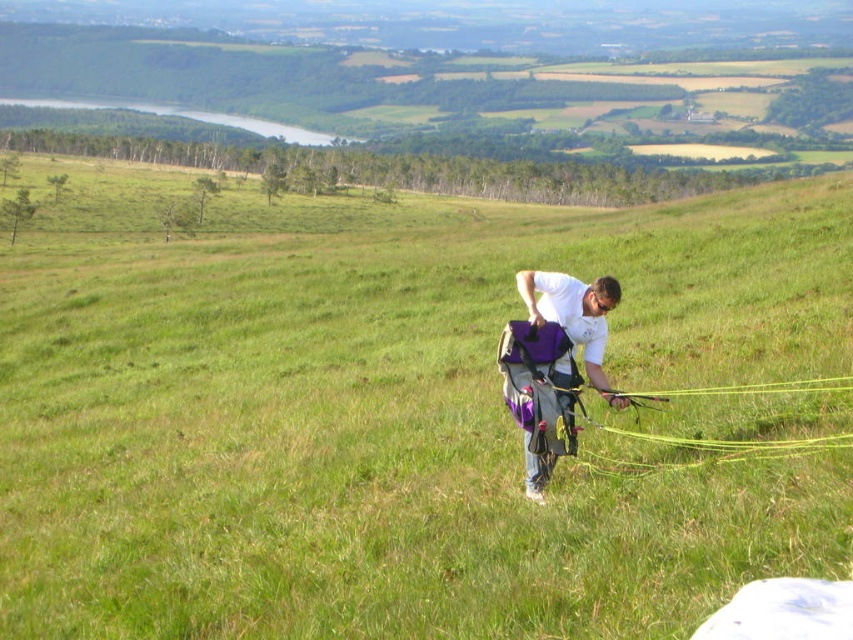
You are standing at the point marked as point (711, 449) and see yellow string at center. Can you step on the yellow string at center without moving from your current position?

Yes, since you are already at the point where the yellow string at center is located, you can step on it without moving.

You are a hiker who just arrived at the grassy hillside. You see the yellow string at center and the purple fabric backpack at center. Which object is wider?

The yellow string at center might be wider than the purple fabric backpack at center.

You are a hiker who just arrived at the hillside. You see the yellow string at center and the purple fabric backpack at center. Which one is higher from the ground?

The yellow string at center is above the purple fabric backpack at center, so the yellow string at center is higher from the ground.